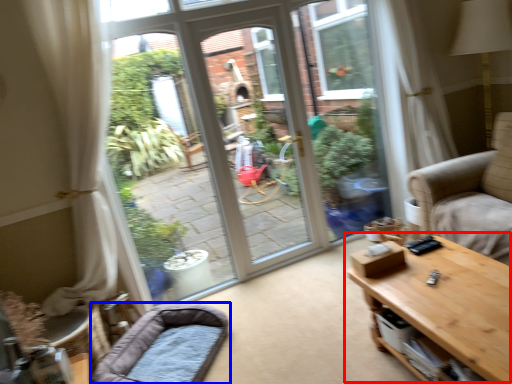
Question: Which of the following is the farthest to the observer, table (highlighted by a red box) or dog bed (highlighted by a blue box)?

Choices:
 (A) table
 (B) dog bed

Answer: (B)